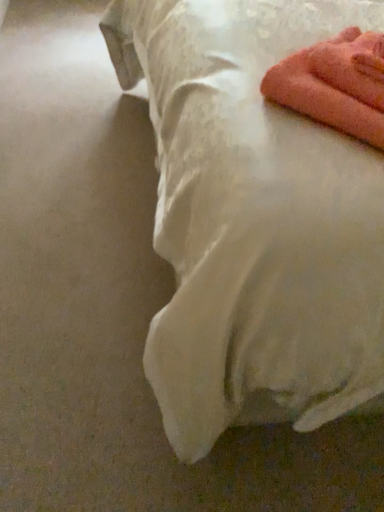
Question: Is pink fluffy towel at upper right shorter than white satin bed at upper right?

Choices:
 (A) yes
 (B) no

Answer: (A)

Question: From the image's perspective, would you say pink fluffy towel at upper right is positioned over white satin bed at upper right?

Choices:
 (A) no
 (B) yes

Answer: (A)

Question: Considering the relative sizes of pink fluffy towel at upper right and white satin bed at upper right in the image provided, is pink fluffy towel at upper right smaller than white satin bed at upper right?

Choices:
 (A) no
 (B) yes

Answer: (B)

Question: Is pink fluffy towel at upper right thinner than white satin bed at upper right?

Choices:
 (A) yes
 (B) no

Answer: (A)

Question: Would you say pink fluffy towel at upper right is outside white satin bed at upper right?

Choices:
 (A) no
 (B) yes

Answer: (A)

Question: From a real-world perspective, is pink fluffy towel at upper right on white satin bed at upper right?

Choices:
 (A) no
 (B) yes

Answer: (B)

Question: Is white satin bed at upper right positioned far away from pink fluffy towel at upper right?

Choices:
 (A) no
 (B) yes

Answer: (A)

Question: Is pink fluffy towel at upper right surrounded by white satin bed at upper right?

Choices:
 (A) no
 (B) yes

Answer: (B)

Question: Does white satin bed at upper right have a lesser width compared to pink fluffy towel at upper right?

Choices:
 (A) yes
 (B) no

Answer: (B)

Question: Could you tell me if white satin bed at upper right is facing pink fluffy towel at upper right?

Choices:
 (A) no
 (B) yes

Answer: (B)

Question: Does white satin bed at upper right have a greater height compared to pink fluffy towel at upper right?

Choices:
 (A) no
 (B) yes

Answer: (B)

Question: Considering the relative positions of white satin bed at upper right and pink fluffy towel at upper right in the image provided, is white satin bed at upper right to the left of pink fluffy towel at upper right from the viewer's perspective?

Choices:
 (A) no
 (B) yes

Answer: (B)

Question: Looking at the image, does pink fluffy towel at upper right seem bigger or smaller compared to white satin bed at upper right?

Choices:
 (A) small
 (B) big

Answer: (A)